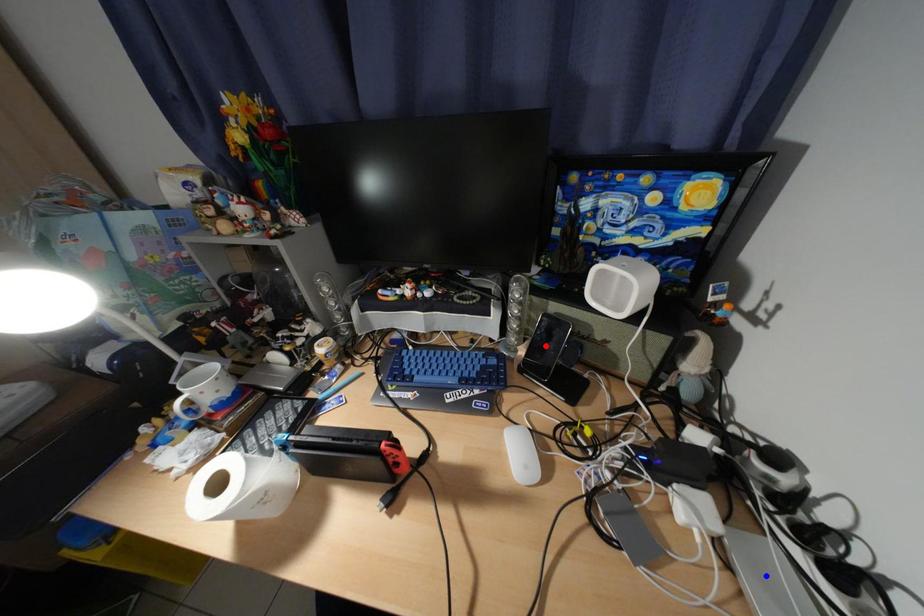
Question: Two points are marked on the image. Which point is closer to the camera?

Choices:
 (A) Blue point is closer.
 (B) Red point is closer.

Answer: (A)